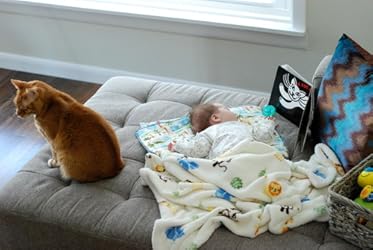
Where is `baby blanket`? baby blanket is located at coordinates (248, 178).